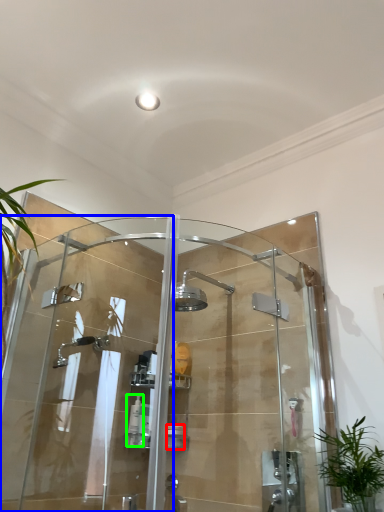
Question: Which object is the closest to the toiletry (highlighted by a red box)? Choose among these: screen door (highlighted by a blue box) or toiletry (highlighted by a green box).

Choices:
 (A) screen door
 (B) toiletry

Answer: (B)